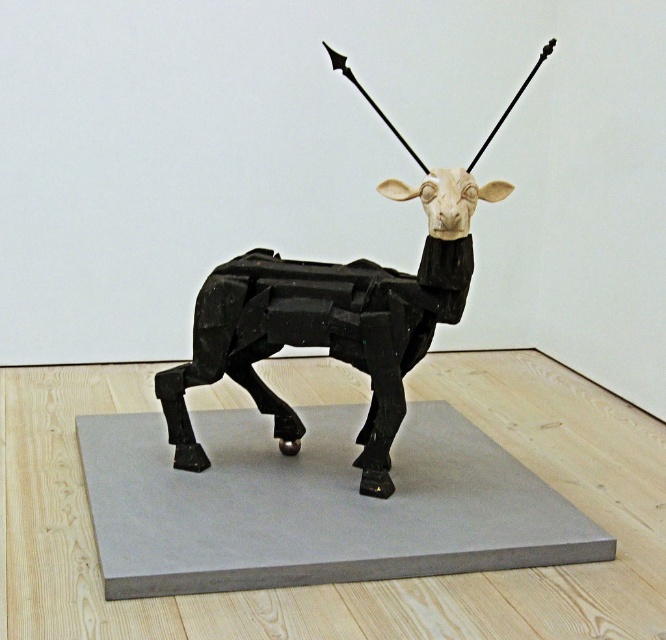
Question: Is gray matte platform at center closer to the viewer compared to matte black sculpture at center?

Choices:
 (A) no
 (B) yes

Answer: (B)

Question: Does gray matte platform at center have a greater width compared to matte black sculpture at center?

Choices:
 (A) no
 (B) yes

Answer: (B)

Question: Does gray matte platform at center have a greater width compared to matte black sculpture at center?

Choices:
 (A) no
 (B) yes

Answer: (B)